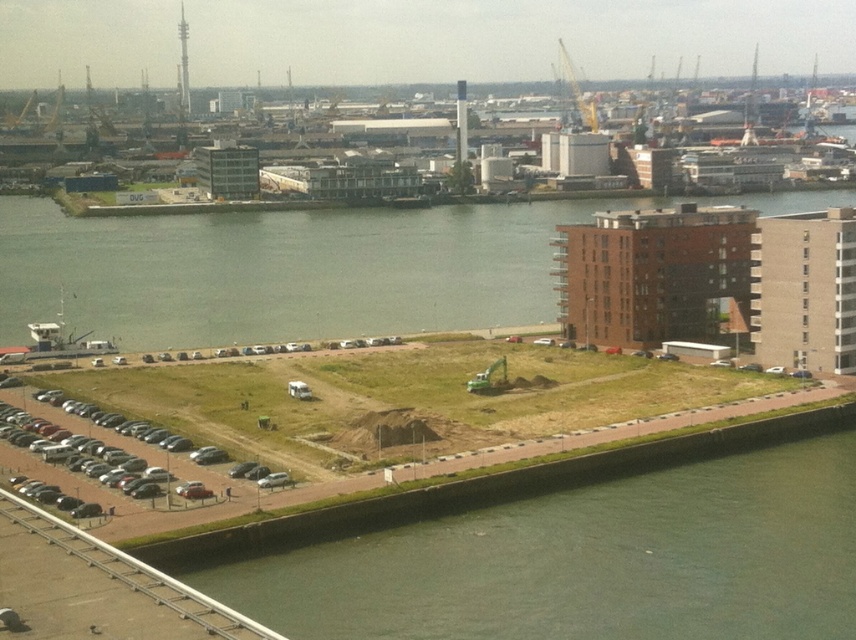
Does green grass at lower left have a smaller size compared to white plastic boat at lower left?

Incorrect, green grass at lower left is not smaller in size than white plastic boat at lower left.

Is point (851, 561) more distant than point (76, 349)?

No, (851, 561) is in front of (76, 349).

I want to click on green grass at lower left, so click(x=586, y=561).

Is green grass at lower left smaller than metallic gray cars at lower left?

Incorrect, green grass at lower left is not smaller in size than metallic gray cars at lower left.

Which of these two, green grass at lower left or metallic gray cars at lower left, stands shorter?

Standing shorter between the two is metallic gray cars at lower left.

Is point (539, 577) farther from viewer compared to point (37, 440)?

That is False.

Locate an element on the screen. green grass at lower left is located at coordinates (586, 561).

Does green grass at lower left have a greater height compared to green grass at lower center?

No, green grass at lower left is not taller than green grass at lower center.

Can you confirm if green grass at lower left is positioned to the right of green grass at lower center?

Indeed, green grass at lower left is positioned on the right side of green grass at lower center.

Which is behind, point (628, 588) or point (171, 292)?

Point (171, 292)

At what (x,y) coordinates should I click in order to perform the action: click on green grass at lower left. Please return your answer as a coordinate pair (x, y). The image size is (856, 640). Looking at the image, I should click on (586, 561).